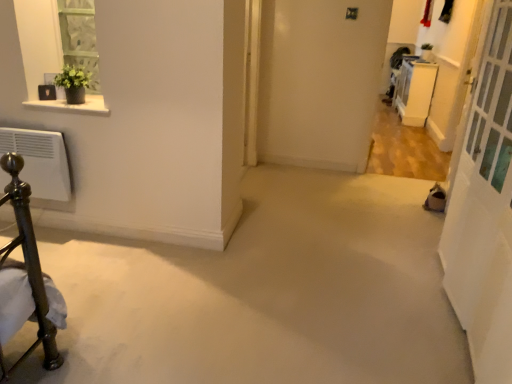
In order to click on vacant location behind white glass screen door at right in this screenshot , I will do `click(373, 237)`.